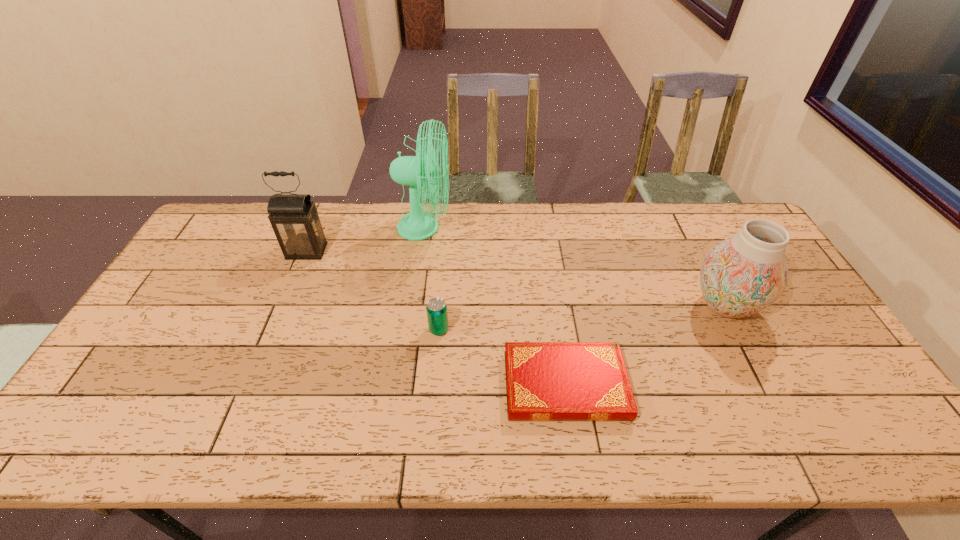
Find the location of a particular element. unoccupied area between the fan and the beer can is located at coordinates (432, 279).

Image resolution: width=960 pixels, height=540 pixels. Find the location of `vacant area that lies between the fourth tallest object and the leftmost object`. vacant area that lies between the fourth tallest object and the leftmost object is located at coordinates tap(372, 291).

Choose which object is the nearest neighbor to the vase. Please provide its 2D coordinates. Your answer should be formatted as a tuple, i.e. [(x, y)], where the tuple contains the x and y coordinates of a point satisfying the conditions above.

[(545, 381)]

I want to click on the fourth closest object relative to the rightmost object, so click(x=294, y=218).

Image resolution: width=960 pixels, height=540 pixels. I want to click on free space in the image that satisfies the following two spatial constraints: 1. in front of the fan to blow air; 2. on the back side of the beer can, so click(x=410, y=329).

The image size is (960, 540). Find the location of `vacant point that satisfies the following two spatial constraints: 1. in front of the rightmost object to blow air; 2. on the right side of the tallest object`. vacant point that satisfies the following two spatial constraints: 1. in front of the rightmost object to blow air; 2. on the right side of the tallest object is located at coordinates (414, 305).

The image size is (960, 540). In order to click on vacant space that satisfies the following two spatial constraints: 1. in front of the fan to blow air; 2. on the front-facing side of the leftmost object in this screenshot , I will do `click(421, 251)`.

The image size is (960, 540). I want to click on vacant space that satisfies the following two spatial constraints: 1. on the front side of the vase; 2. on the cover of the nearest object, so click(x=767, y=385).

You are a GUI agent. You are given a task and a screenshot of the screen. Output one action in this format:
    pyautogui.click(x=<x>, y=<y>)
    Task: Click on the free point that satisfies the following two spatial constraints: 1. on the front-facing side of the second shortest object; 2. on the left side of the lantern
    The image size is (960, 540).
    Given the screenshot: What is the action you would take?
    pyautogui.click(x=275, y=329)

Locate an element on the screen. The image size is (960, 540). vacant space that satisfies the following two spatial constraints: 1. in front of the fan to blow air; 2. on the back side of the vase is located at coordinates (414, 305).